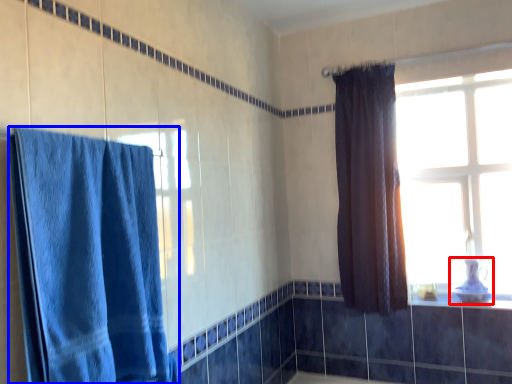
Question: Which point is further to the camera, sink (highlighted by a red box) or curtain (highlighted by a blue box)?

Choices:
 (A) sink
 (B) curtain

Answer: (A)